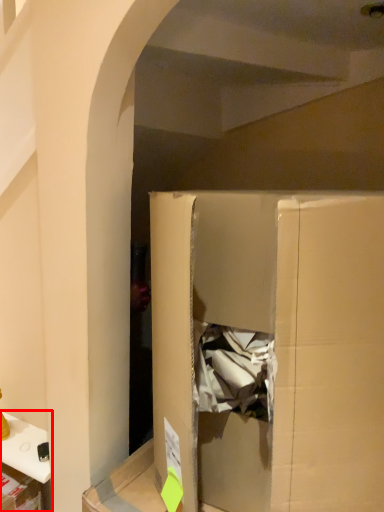
Question: In this image, where is furniture (annotated by the red box) located relative to cardboard box?

Choices:
 (A) left
 (B) right

Answer: (A)